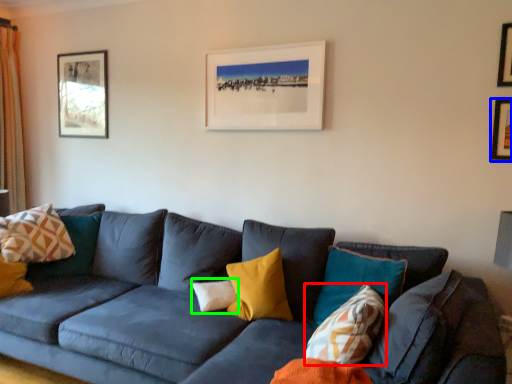
Question: Estimate the real-world distances between objects in this image. Which object is closer to pillow (highlighted by a red box), picture frame (highlighted by a blue box) or pillow (highlighted by a green box)?

Choices:
 (A) picture frame
 (B) pillow

Answer: (B)